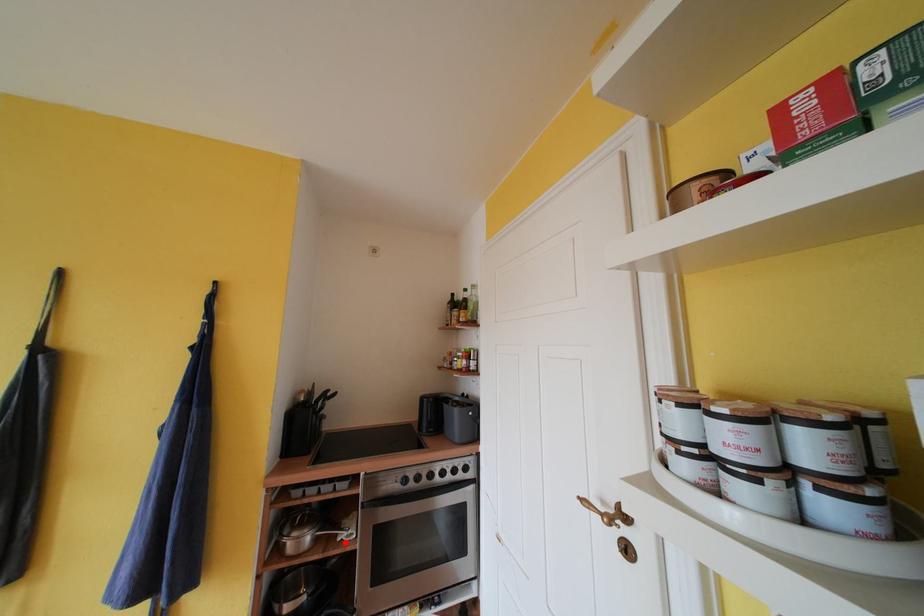
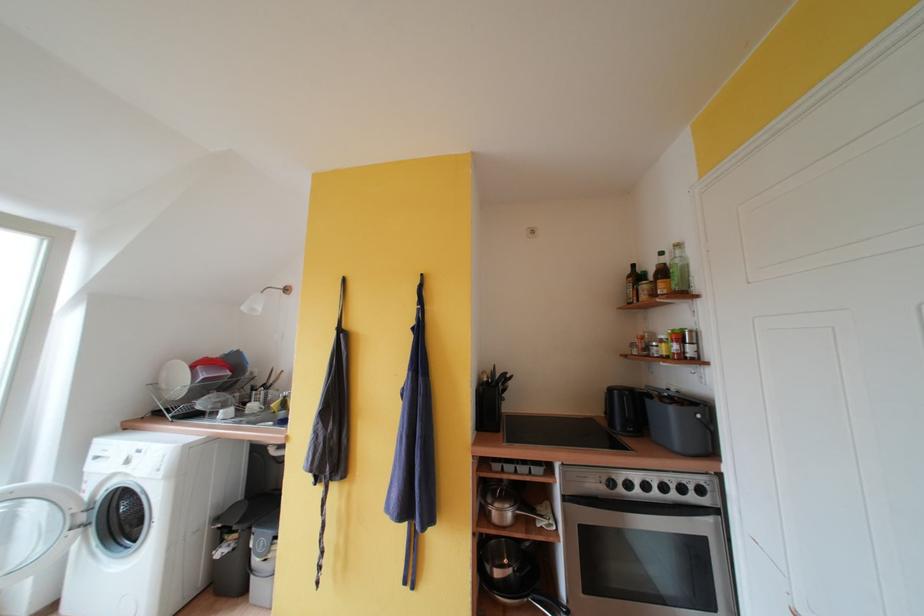
Find the pixel in the second image that matches the highlighted location in the first image.

(544, 529)